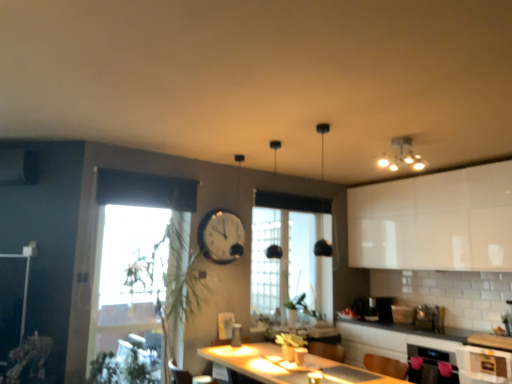
Question: Is point (394, 336) closer or farther from the camera than point (164, 241)?

Choices:
 (A) closer
 (B) farther

Answer: (B)

Question: From the image's perspective, is white glossy countertop at lower right above or below transparent glass window at left, which is the 1th window from left to right?

Choices:
 (A) below
 (B) above

Answer: (A)

Question: Which is farther from the white glossy cabinet at lower right, the 2th cabinetry in the top-to-bottom sequence?

Choices:
 (A) matte white light fixture at upper right
 (B) white glossy cabinet at upper right, arranged as the 1th cabinetry when viewed from the top
 (C) transparent glass window at left, which is the 1th window from left to right
 (D) white glossy countertop at lower right
 (E) green leafy plant at lower left

Answer: (C)

Question: Considering the real-world distances, which object is farthest from the white glossy cabinet at upper right, the second cabinetry in the bottom-to-top sequence?

Choices:
 (A) matte white light fixture at upper right
 (B) green leafy plant at lower left
 (C) white glossy countertop at lower right
 (D) white glossy cabinet at lower right, positioned as the first cabinetry in bottom-to-top order
 (E) metallic silver clock at center

Answer: (B)